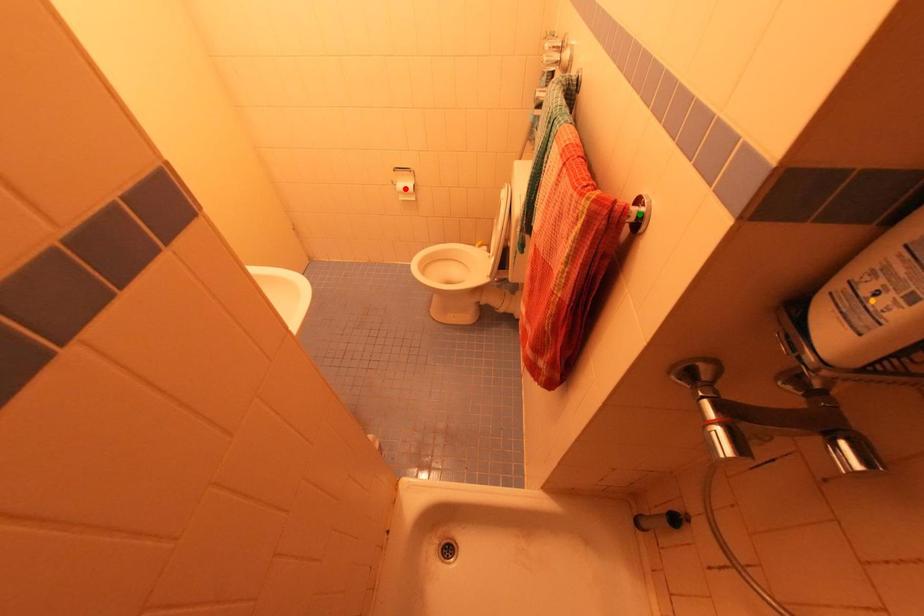
Order these from nearest to farthest:
A) green point
B) red point
C) orange point

red point < green point < orange point